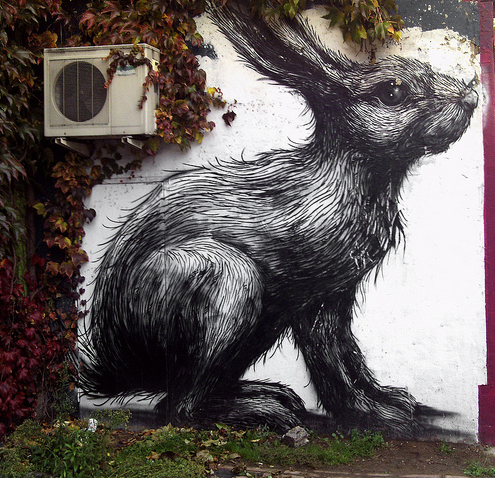
Where is `giant painting of a rabbit in black and white`? The height and width of the screenshot is (478, 495). giant painting of a rabbit in black and white is located at coordinates (285, 236).